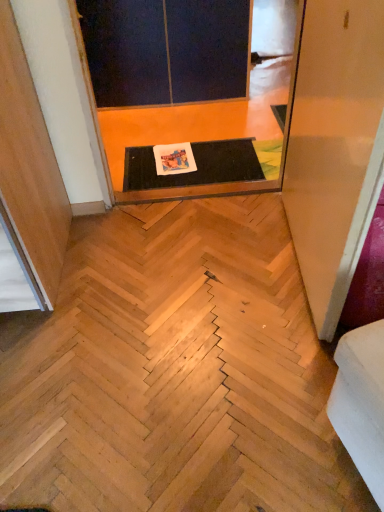
Question: From the image's perspective, would you say transparent plastic screen door at upper right, placed as the 3th screen door when sorted from back to front, is shown under natural wood stairwell at center?

Choices:
 (A) yes
 (B) no

Answer: (B)

Question: Would you say transparent plastic screen door at upper right, the first screen door when ordered from front to back, is outside natural wood stairwell at center?

Choices:
 (A) no
 (B) yes

Answer: (B)

Question: From a real-world perspective, is transparent plastic screen door at upper right, the first screen door when ordered from front to back, physically below natural wood stairwell at center?

Choices:
 (A) yes
 (B) no

Answer: (B)

Question: Considering the relative sizes of transparent plastic screen door at upper right, the first screen door when ordered from front to back, and natural wood stairwell at center in the image provided, is transparent plastic screen door at upper right, the first screen door when ordered from front to back, shorter than natural wood stairwell at center?

Choices:
 (A) yes
 (B) no

Answer: (B)

Question: Is transparent plastic screen door at upper right, the first screen door when ordered from front to back, positioned with its back to natural wood stairwell at center?

Choices:
 (A) yes
 (B) no

Answer: (B)

Question: Is natural wood stairwell at center completely or partially inside transparent plastic screen door at upper right, placed as the 3th screen door when sorted from back to front?

Choices:
 (A) yes
 (B) no

Answer: (B)

Question: Considering the relative sizes of natural wood stairwell at center and white fabric couch at lower right in the image provided, is natural wood stairwell at center thinner than white fabric couch at lower right?

Choices:
 (A) no
 (B) yes

Answer: (A)

Question: From a real-world perspective, is natural wood stairwell at center beneath white fabric couch at lower right?

Choices:
 (A) yes
 (B) no

Answer: (A)

Question: Is natural wood stairwell at center not close to white fabric couch at lower right?

Choices:
 (A) yes
 (B) no

Answer: (B)

Question: Is natural wood stairwell at center smaller than white fabric couch at lower right?

Choices:
 (A) yes
 (B) no

Answer: (B)

Question: Considering the relative sizes of natural wood stairwell at center and white fabric couch at lower right in the image provided, is natural wood stairwell at center taller than white fabric couch at lower right?

Choices:
 (A) no
 (B) yes

Answer: (A)

Question: Is natural wood stairwell at center facing towards white fabric couch at lower right?

Choices:
 (A) yes
 (B) no

Answer: (B)

Question: From a real-world perspective, is dark matte screen door at upper center, arranged as the first screen door when viewed from the back, over white fabric couch at lower right?

Choices:
 (A) no
 (B) yes

Answer: (B)